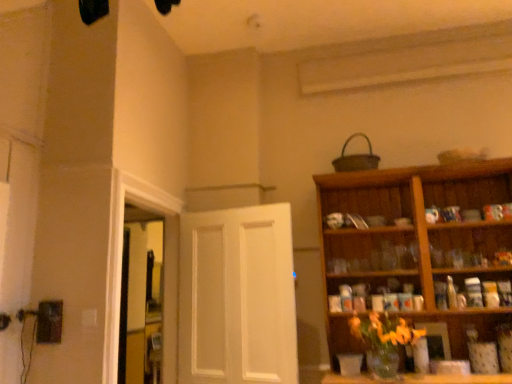
Question: In terms of size, does white matte door at center appear bigger or smaller than transparent glass window at left?

Choices:
 (A) small
 (B) big

Answer: (A)

Question: Does point (199, 218) appear closer or farther from the camera than point (146, 332)?

Choices:
 (A) farther
 (B) closer

Answer: (B)

Question: Which object is the farthest from the wooden cabinet at upper right?

Choices:
 (A) white matte door at center
 (B) transparent glass window at left

Answer: (B)

Question: Estimate the real-world distances between objects in this image. Which object is closer to the wooden cabinet at upper right?

Choices:
 (A) transparent glass window at left
 (B) white matte door at center

Answer: (B)